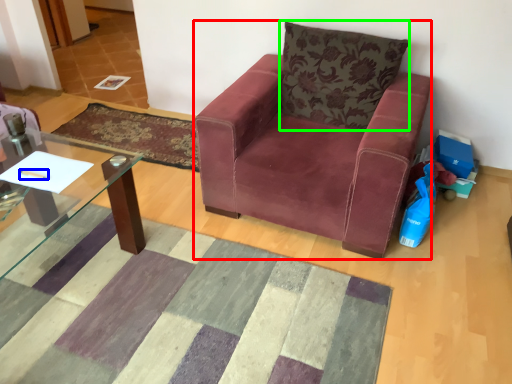
Question: Based on their relative distances, which object is nearer to chair (highlighted by a red box)? Choose from pen (highlighted by a blue box) and pillow (highlighted by a green box).

Choices:
 (A) pen
 (B) pillow

Answer: (B)